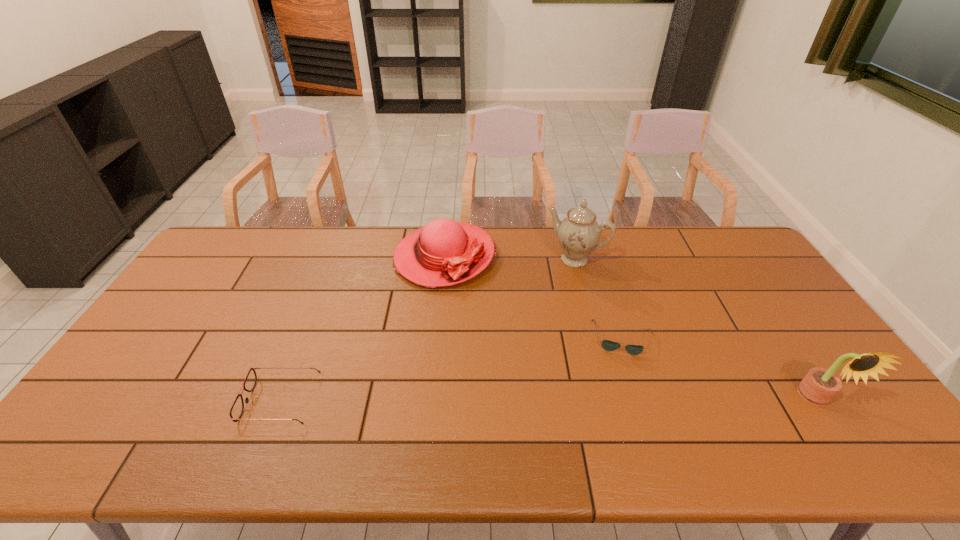
This screenshot has width=960, height=540. I want to click on hat at the far edge, so click(444, 252).

You are a GUI agent. You are given a task and a screenshot of the screen. Output one action in this format:
    pyautogui.click(x=<x>, y=<y>)
    Task: Click on the sunglasses located at the near edge
    The height and width of the screenshot is (540, 960).
    Given the screenshot: What is the action you would take?
    pyautogui.click(x=237, y=408)

Image resolution: width=960 pixels, height=540 pixels. I want to click on sunflower at the near edge, so tap(819, 386).

Where is `object at the right edge`? object at the right edge is located at coordinates (819, 386).

This screenshot has width=960, height=540. What are the coordinates of `object present at the near right corner` in the screenshot? It's located at (819, 386).

Where is `vacant point at the far edge`? This screenshot has height=540, width=960. vacant point at the far edge is located at coordinates (385, 233).

Identify the location of vacant space at the near edge of the desktop. Image resolution: width=960 pixels, height=540 pixels. (614, 421).

What are the coordinates of `free space at the left edge` in the screenshot? It's located at (225, 276).

Find the location of a particular element. free location at the right edge of the desktop is located at coordinates (736, 288).

This screenshot has height=540, width=960. I want to click on free space at the far right corner, so click(745, 258).